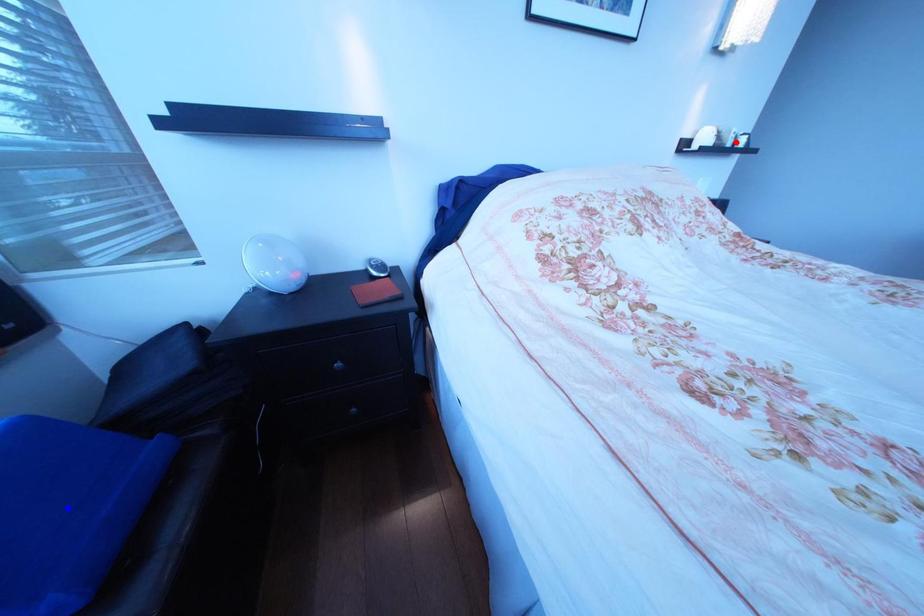
Question: Which of the two points in the image is closer to the camera?

Choices:
 (A) Blue point is closer.
 (B) Red point is closer.

Answer: (A)